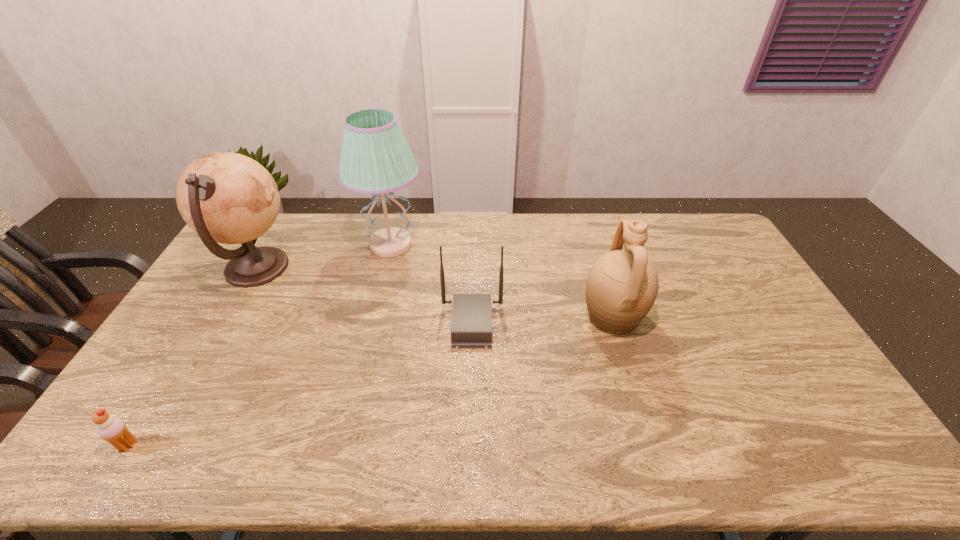
Locate an element on the screen. free space at the near edge of the desktop is located at coordinates (496, 458).

In the image, there is a desktop. Where is `free space at the left edge`? This screenshot has width=960, height=540. free space at the left edge is located at coordinates (198, 292).

Locate an element on the screen. free space at the far right corner of the desktop is located at coordinates (681, 231).

Identify the location of empty space between the router and the icecream. (300, 384).

Locate an element on the screen. This screenshot has height=540, width=960. vacant point located between the router and the shortest object is located at coordinates (300, 384).

Locate an element on the screen. The width and height of the screenshot is (960, 540). vacant space in between the nearest object and the third tallest object is located at coordinates (371, 381).

Identify the location of free space between the second object from right to left and the shortest object. This screenshot has height=540, width=960. (300, 384).

The width and height of the screenshot is (960, 540). I want to click on vacant area that lies between the globe and the icecream, so click(192, 356).

This screenshot has width=960, height=540. What are the coordinates of `empty space between the nearest object and the router` in the screenshot? It's located at (300, 384).

The height and width of the screenshot is (540, 960). Identify the location of unoccupied area between the globe and the fourth object from left to right. (364, 296).